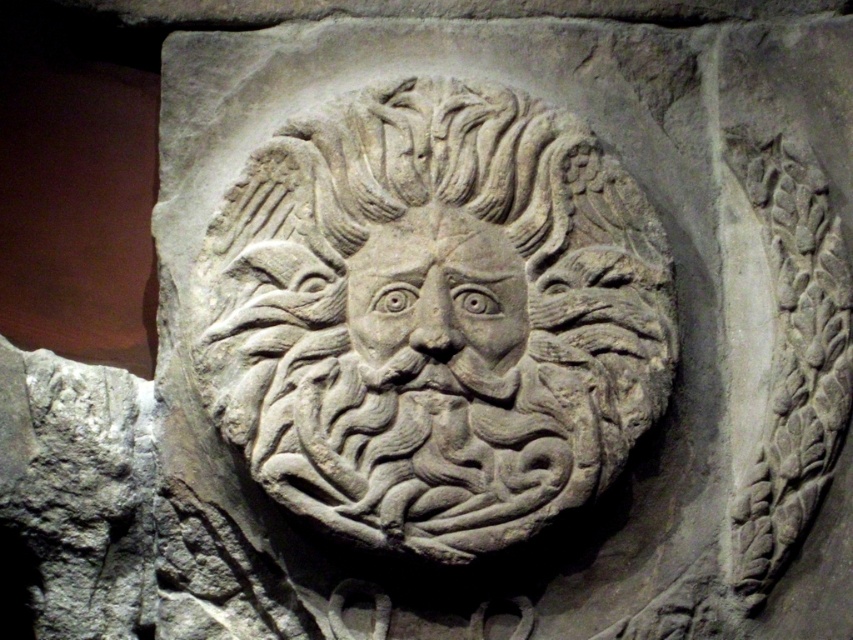
Question: Can you confirm if gray stone lion at center is smaller than carved stone face at center?

Choices:
 (A) no
 (B) yes

Answer: (A)

Question: Is gray stone lion at center to the left of carved stone face at center from the viewer's perspective?

Choices:
 (A) yes
 (B) no

Answer: (A)

Question: Among these points, which one is farthest from the camera?

Choices:
 (A) (460, 257)
 (B) (534, 264)

Answer: (B)

Question: Does gray stone lion at center appear on the left side of carved stone face at center?

Choices:
 (A) yes
 (B) no

Answer: (A)

Question: Among these points, which one is farthest from the camera?

Choices:
 (A) (401, 268)
 (B) (450, 141)

Answer: (B)